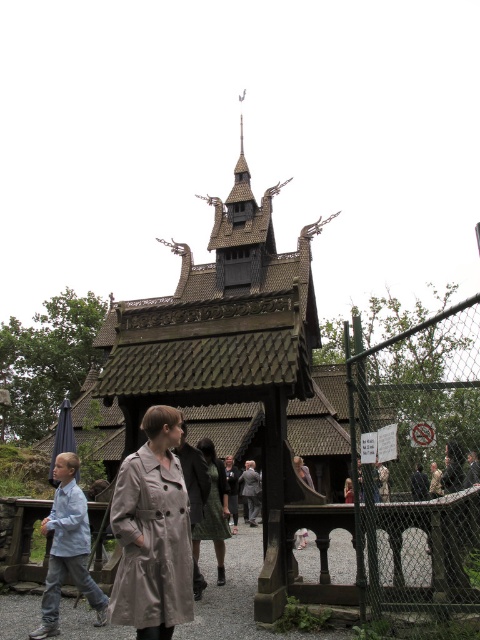
You are standing at the entrance of the Norwegian stave church and want to take a photo of the point at coordinates point (58, 616). If your camera has a maximum zoom range of 40 meters, will you be able to capture the point in focus without moving closer?

The point at coordinates point (58, 616) is 37.55 meters away from the viewer. Since the camera can zoom up to 40 meters, it is within the maximum range. Therefore, you can capture the point in focus without moving closer.

Looking at this image, you are standing at the entrance of the Norwegian stave church and want to take a photo of the point at coordinate (70, 572). If your camera has a maximum zoom range of 40 meters, will you be able to capture that point clearly?

The distance of point (70, 572) from viewer is 38.84 meters, which is within the camera maximum zoom range of 40 meters. Therefore, you can capture the point clearly.

You are visiting the Norwegian stave church and see the light blue denim jeans at lower left and the matte black dress at center. Which clothing item is positioned closer to the ground?

The light blue denim jeans at lower left is located below the matte black dress at center, so it is closer to the ground.